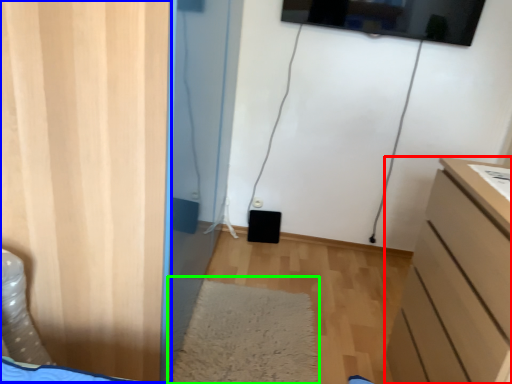
Question: Which object is positioned closest to chest of drawers (highlighted by a red box)? Select from door (highlighted by a blue box) and mat (highlighted by a green box).

Choices:
 (A) door
 (B) mat

Answer: (B)